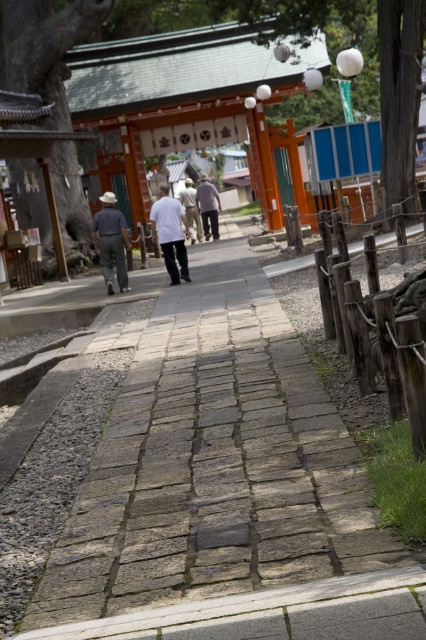
Looking at this image, how far apart are denim jacket at left and light brown fabric pants at center?

denim jacket at left and light brown fabric pants at center are 51.31 feet apart from each other.

Who is more distant from viewer, (x=126, y=275) or (x=190, y=225)?

The point (x=190, y=225) is more distant.

Where is `denim jacket at left`? denim jacket at left is located at coordinates (111, 241).

Is rustic wooden fence at right below denim jacket at left?

Yes.

In order to click on rustic wooden fence at right in this screenshot , I will do `click(382, 340)`.

Locate an element on the screen. The image size is (426, 640). rustic wooden fence at right is located at coordinates (382, 340).

Does gray stone pavement at center have a lesser height compared to rustic wooden fence at right?

No.

Is gray stone pavement at center to the left of rustic wooden fence at right from the viewer's perspective?

Indeed, gray stone pavement at center is positioned on the left side of rustic wooden fence at right.

Identify the location of gray stone pavement at center. (224, 490).